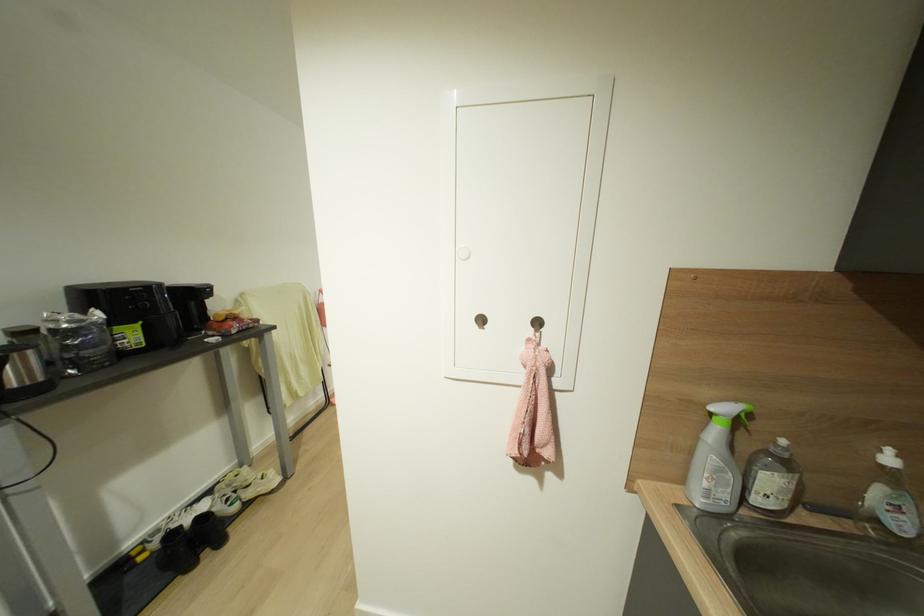
Find where to push the soap dispenser pump. Please return your answer as a coordinate pair (x, y).

(715, 461)